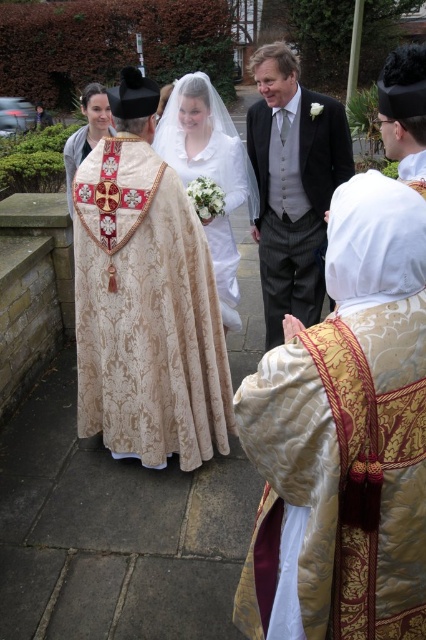
Can you confirm if gold brocade dress at center is bigger than white satin dress at center?

Actually, gold brocade dress at center might be smaller than white satin dress at center.

Which is more to the right, gold brocade dress at center or white satin dress at center?

Positioned to the right is gold brocade dress at center.

Where is `gold brocade dress at center`? Image resolution: width=426 pixels, height=640 pixels. gold brocade dress at center is located at coordinates (340, 474).

Is white satin dress at center wider than matte gold vestment at center?

Yes, white satin dress at center is wider than matte gold vestment at center.

In order to click on white satin dress at center in this screenshot , I will do `click(207, 170)`.

Can you confirm if gold brocade dress at center is taller than gold brocade robe at center?

No.

Between gold brocade dress at center and gold brocade robe at center, which one appears on the right side from the viewer's perspective?

Positioned to the right is gold brocade dress at center.

The height and width of the screenshot is (640, 426). I want to click on gold brocade dress at center, so click(340, 474).